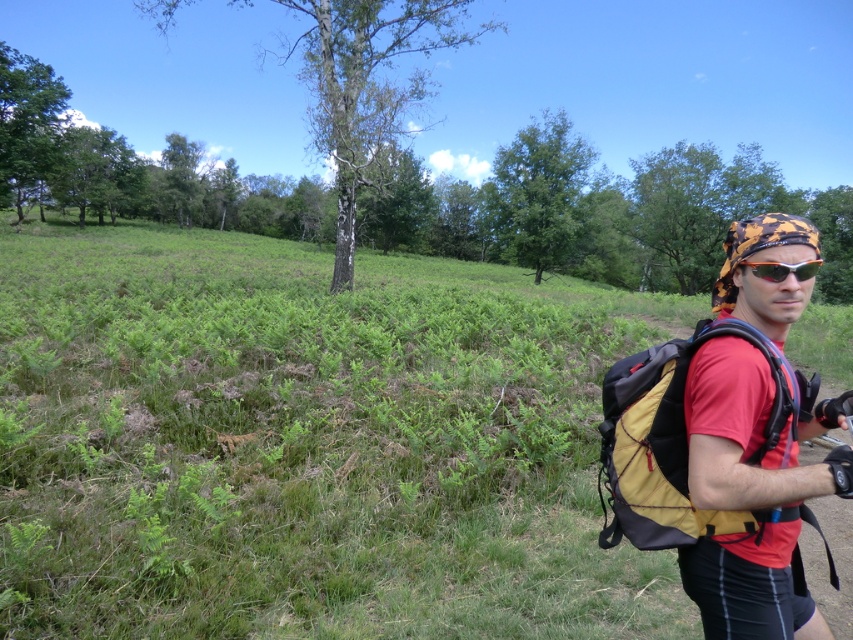
In the scene shown: Measure the distance between green grassy at center and camera.

They are 8.87 feet apart.

Who is more forward, (515, 346) or (747, 266)?

Point (747, 266) is in front.

Find the location of `green grassy at center`. green grassy at center is located at coordinates (309, 444).

Where is `green grassy at center`? Image resolution: width=853 pixels, height=640 pixels. green grassy at center is located at coordinates (309, 444).

Who is shorter, green grassy at center or red fabric bandana at right?

With less height is red fabric bandana at right.

Is green grassy at center in front of red fabric bandana at right?

That is False.

Who is more forward, (267,321) or (767,496)?

Point (767,496) is in front.

Image resolution: width=853 pixels, height=640 pixels. I want to click on green grassy at center, so click(309, 444).

Who is positioned more to the right, red fabric bandana at right or yellow fabric backpack at right?

red fabric bandana at right

Between red fabric bandana at right and yellow fabric backpack at right, which one is positioned lower?

yellow fabric backpack at right is lower down.

Describe the element at coordinates (750, 435) in the screenshot. I see `red fabric bandana at right` at that location.

Where is `red fabric bandana at right`? The width and height of the screenshot is (853, 640). red fabric bandana at right is located at coordinates (750, 435).